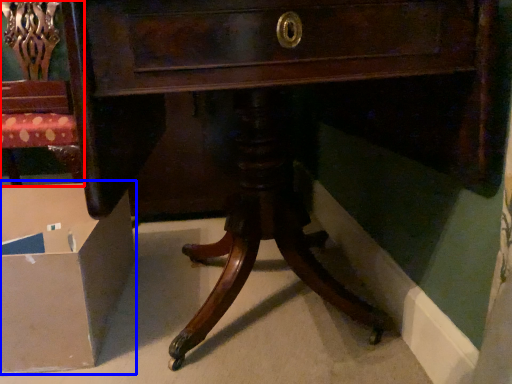
Question: Which object appears closest to the camera in this image, chair (highlighted by a red box) or cardboard box (highlighted by a blue box)?

Choices:
 (A) chair
 (B) cardboard box

Answer: (B)